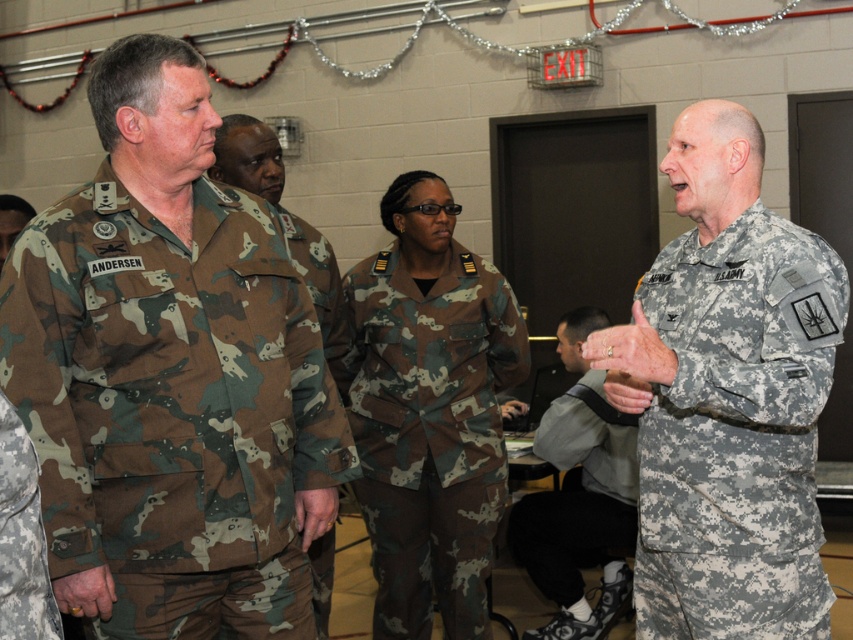
You are a military recruit standing at the point marked by coordinates (170, 400) in the image. Looking around, you see a camo fabric uniform at left. Which direction should you face to see the festive garlands hanging on the wall?

The festive garlands are hanging along the top edge of the wall. Since you are at point (170, 400) facing the camo fabric uniform at left, you should turn to face upwards or look upward to see the festive garlands on the top edge of the wall.

You are an observer in the room. You notice two uniforms, the camo fabric uniform at left and the camo uniform at center. Which one is taller?

The camo fabric uniform at left is taller than the camo uniform at center.

Where is the camouflage fabric uniform at right located in the image?

The camouflage fabric uniform at right is located at point (737, 433).